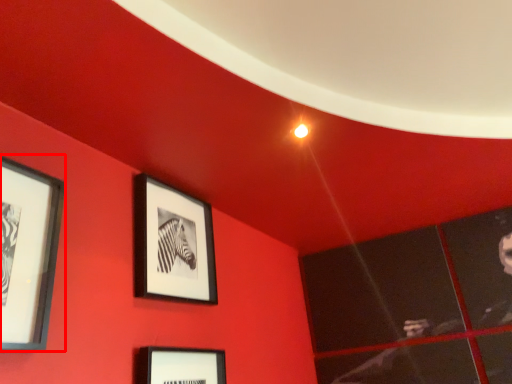
Question: From the image, what is the correct spatial relationship of picture frame (annotated by the red box) in relation to picture frame?

Choices:
 (A) right
 (B) left

Answer: (B)